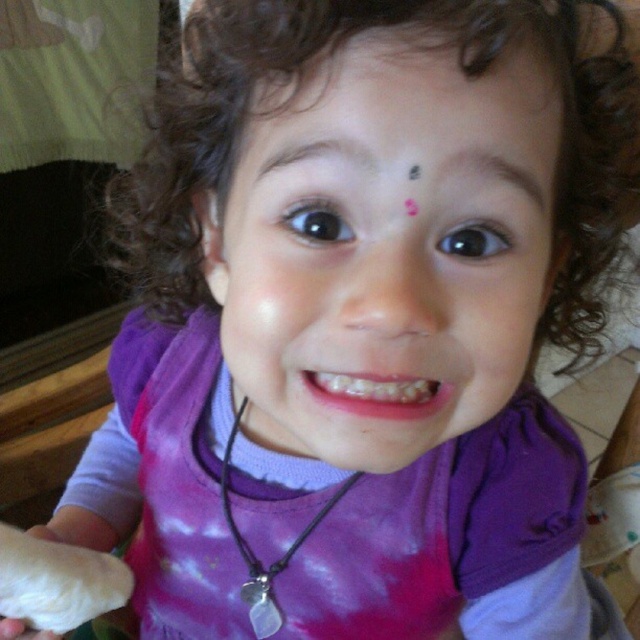
Between point (520, 285) and point (284, 560), which one is positioned in front?

Positioned in front is point (520, 285).

Can you confirm if purple fabric face at center is bigger than silver metallic necklace at center?

Correct, purple fabric face at center is larger in size than silver metallic necklace at center.

Which is behind, point (276, 444) or point (269, 563)?

Point (269, 563)

Locate an element on the screen. Image resolution: width=640 pixels, height=640 pixels. purple fabric face at center is located at coordinates (385, 248).

Which of these two, purple fabric face at center or pink matte forehead at upper center, stands taller?

Standing taller between the two is purple fabric face at center.

Is purple fabric face at center to the right of pink matte forehead at upper center from the viewer's perspective?

No, purple fabric face at center is not to the right of pink matte forehead at upper center.

Does point (275, 385) lie behind point (355, 81)?

Yes, it is behind point (355, 81).

Locate an element on the screen. This screenshot has height=640, width=640. purple fabric face at center is located at coordinates (385, 248).

Is pink matte forehead at upper center further to the viewer compared to silver metallic necklace at center?

That is False.

Which is more to the left, pink matte forehead at upper center or silver metallic necklace at center?

silver metallic necklace at center

What do you see at coordinates (406, 81) in the screenshot? I see `pink matte forehead at upper center` at bounding box center [406, 81].

Find the location of a particular element. This screenshot has width=640, height=640. pink matte forehead at upper center is located at coordinates (406, 81).